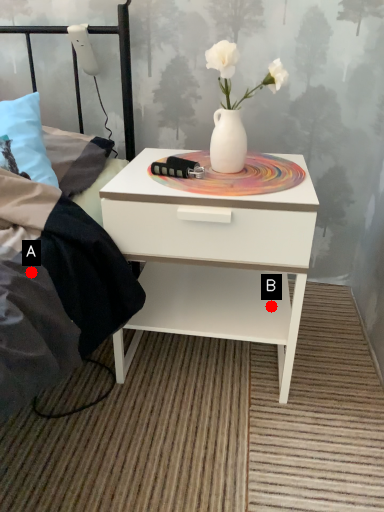
Question: Two points are circled on the image, labeled by A and B beside each circle. Which point appears farthest from the camera in this image?

Choices:
 (A) A is further
 (B) B is further

Answer: (B)